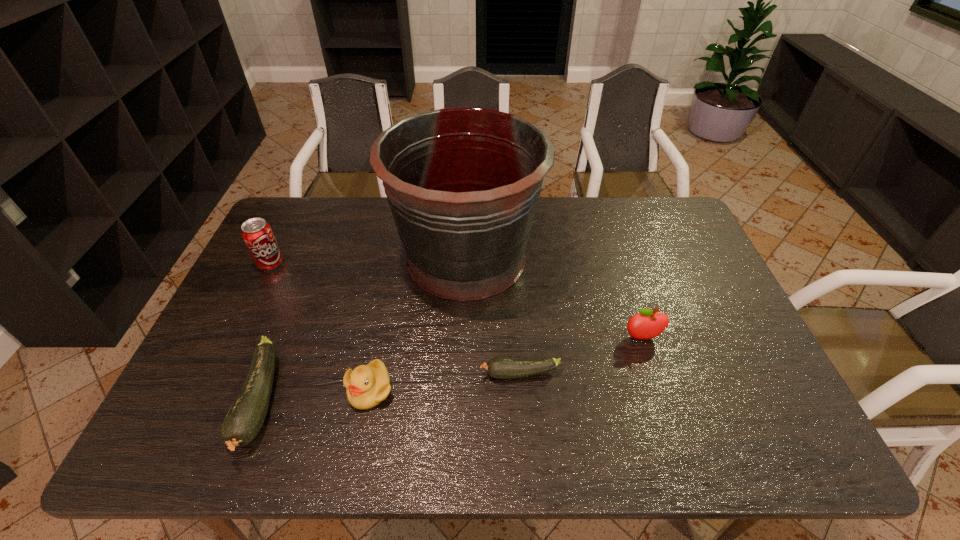
What are the coordinates of `free space located at the blossom end of the shortest object` in the screenshot? It's located at (452, 374).

Image resolution: width=960 pixels, height=540 pixels. I want to click on free region located at the blossom end of the shortest object, so click(x=432, y=374).

The width and height of the screenshot is (960, 540). Find the location of `blank space located 0.200m at the blossom end of the shortest object`. blank space located 0.200m at the blossom end of the shortest object is located at coordinates (400, 374).

This screenshot has height=540, width=960. In order to click on vacant space located 0.340m on the front of the second tallest object in this screenshot , I will do `click(221, 367)`.

At what (x,y) coordinates should I click in order to perform the action: click on vacant area located on the front of the fourth nearest object. Please return your answer as a coordinate pair (x, y). Looking at the image, I should click on (649, 360).

Identify the location of free space located 0.060m on the back of the tallest object. The width and height of the screenshot is (960, 540). (468, 202).

Identify the location of object at the far edge. This screenshot has width=960, height=540. (463, 184).

Identify the location of duckling that is positioned at the near edge. click(x=368, y=385).

Where is `zucchini at the left edge`? zucchini at the left edge is located at coordinates (245, 418).

You are a GUI agent. You are given a task and a screenshot of the screen. Output one action in this format:
    pyautogui.click(x=<x>, y=<y>)
    Task: Click on the soda present at the left edge
    This screenshot has height=540, width=960.
    Given the screenshot: What is the action you would take?
    pos(258,236)